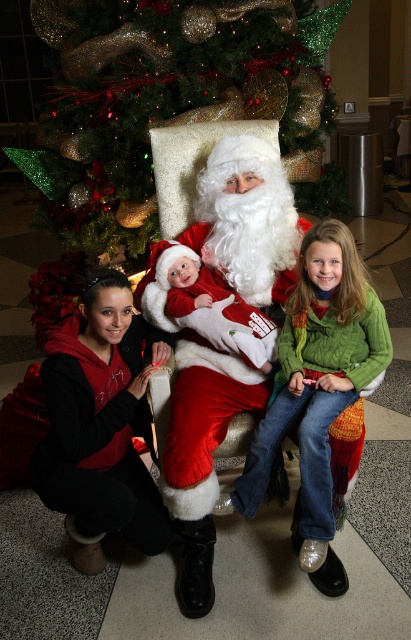
Question: Which point is closer to the camera?

Choices:
 (A) (57, 152)
 (B) (371, 339)
 (C) (226, 189)

Answer: (B)

Question: Among these objects, which one is farthest from the camera?

Choices:
 (A) green knitted sweater at center
 (B) fuzzy white santa at center

Answer: (B)

Question: Can you confirm if green glittery christmas tree at upper center is positioned above matte red santa suit at center?

Choices:
 (A) yes
 (B) no

Answer: (A)

Question: Is matte red santa suit at center smaller than green knitted sweater at center?

Choices:
 (A) yes
 (B) no

Answer: (B)

Question: Based on their relative distances, which object is nearer to the fuzzy white santa at center?

Choices:
 (A) green glittery christmas tree at upper center
 (B) green knitted sweater at center
 (C) matte red santa suit at center

Answer: (C)

Question: Is matte red santa suit at center above green knitted sweater at center?

Choices:
 (A) yes
 (B) no

Answer: (A)